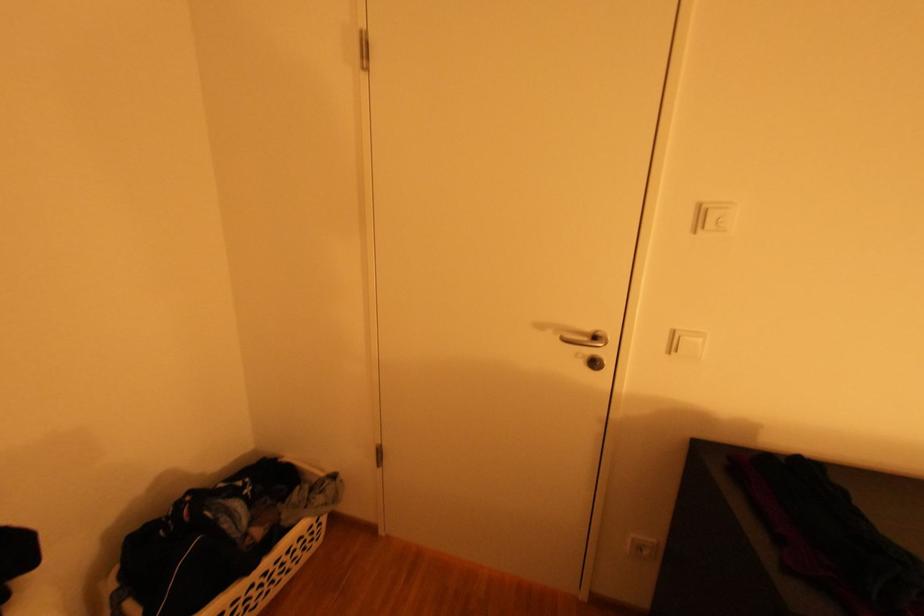
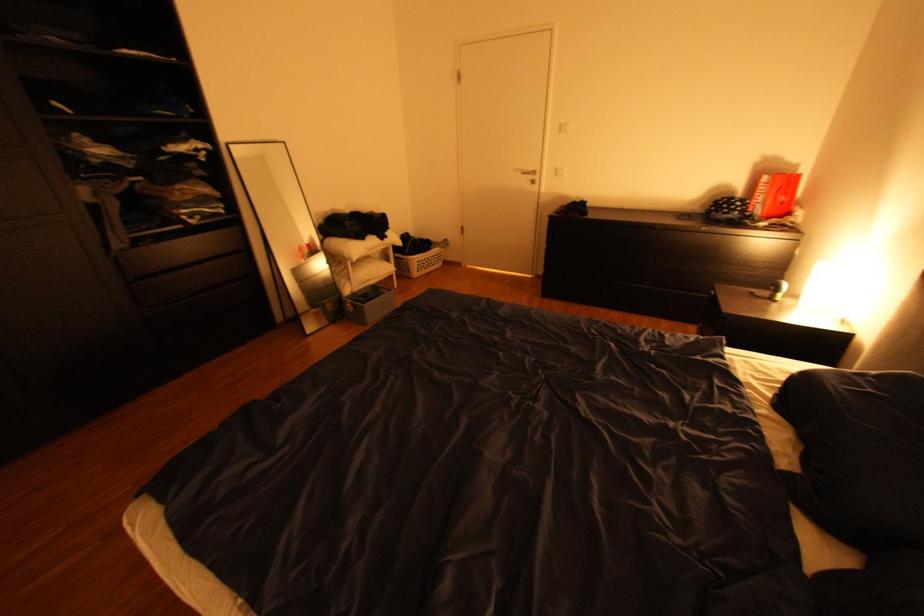
The point at [682,349] is marked in the first image. Where is the corresponding point in the second image?

(565, 174)